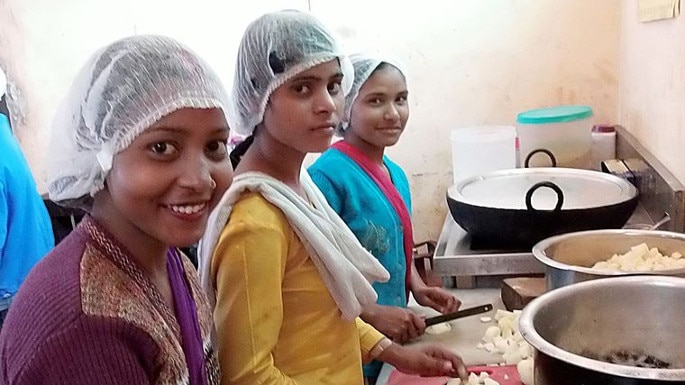
I want to click on wall, so click(x=538, y=47), click(x=653, y=70).